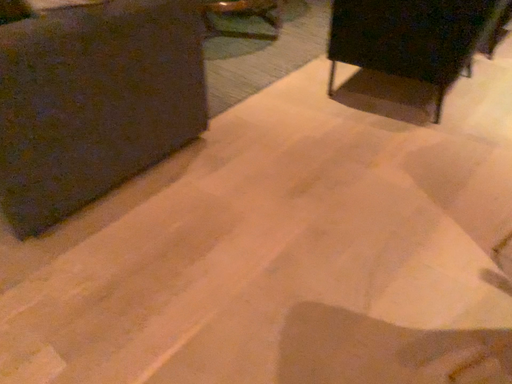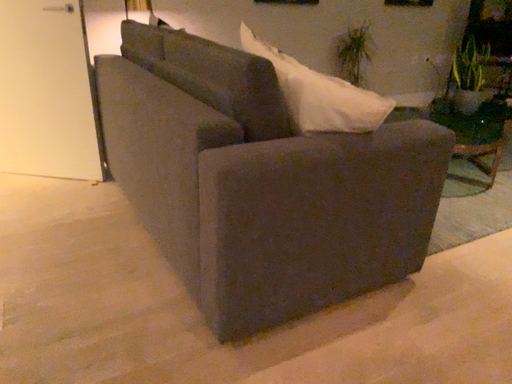
Question: How did the camera likely rotate when shooting the video?

Choices:
 (A) rotated upward
 (B) rotated downward

Answer: (A)